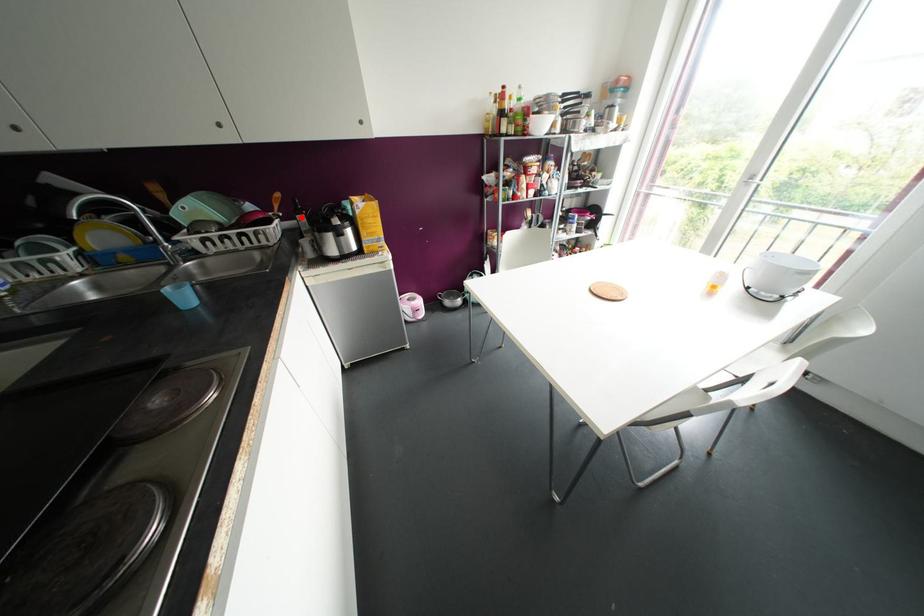
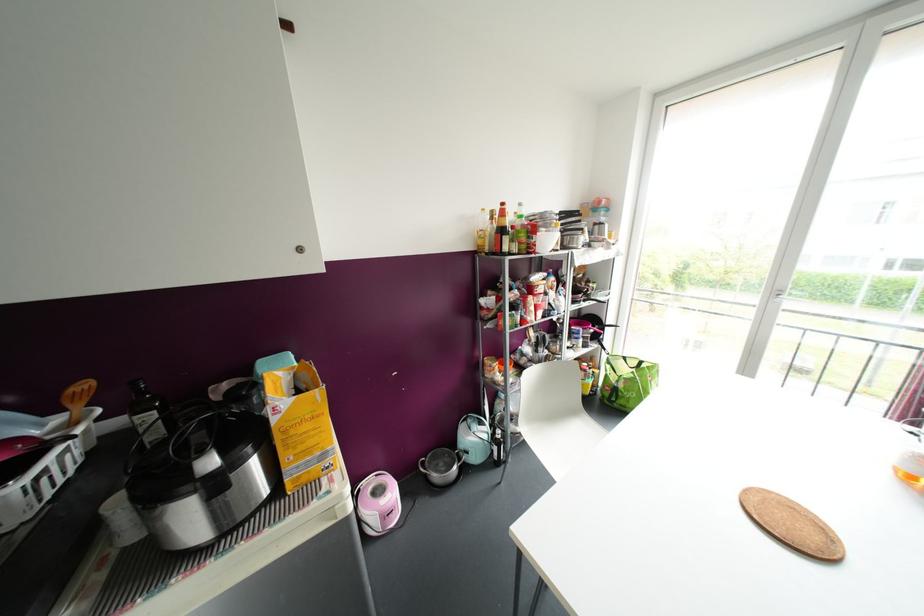
Where in the second image is the point corresponding to the highlighted location from the first image?

(150, 416)